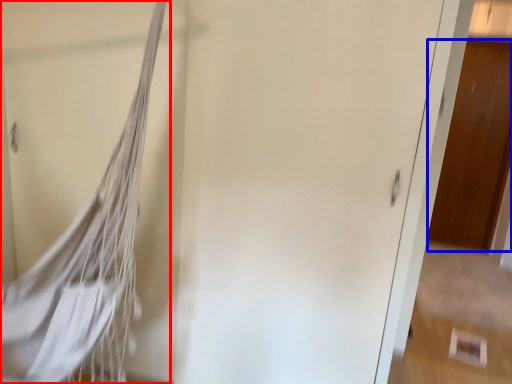
Question: Which object is further to the camera taking this photo, tennis net (highlighted by a red box) or door (highlighted by a blue box)?

Choices:
 (A) tennis net
 (B) door

Answer: (B)